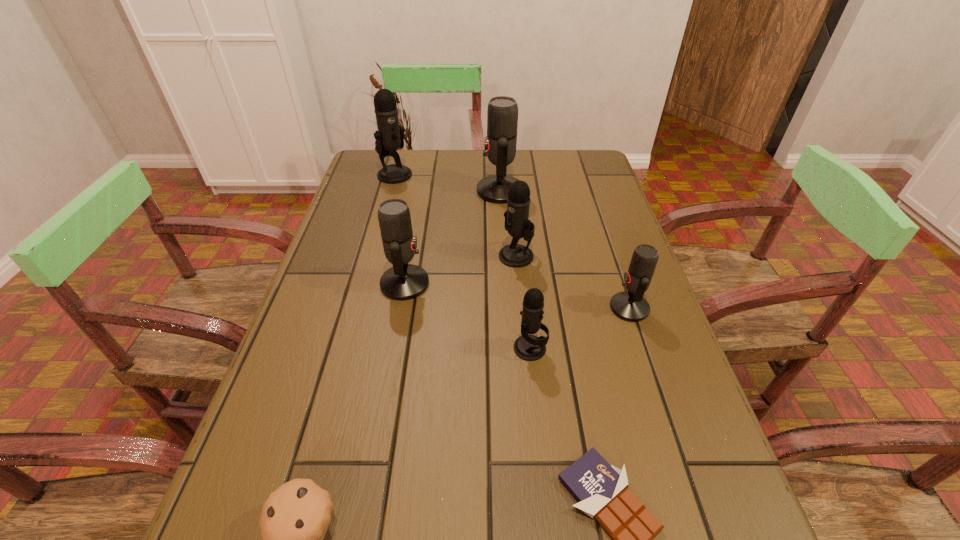
The image size is (960, 540). Find the location of `object that is at the right edge`. object that is at the right edge is located at coordinates (631, 306).

Where is `object located in the far left corner section of the desktop`? object located in the far left corner section of the desktop is located at coordinates (389, 137).

Locate an element on the screen. This screenshot has width=960, height=540. free spot at the far edge of the desktop is located at coordinates (437, 161).

In the image, there is a desktop. Where is `blank space at the left edge`? This screenshot has height=540, width=960. blank space at the left edge is located at coordinates (257, 462).

The image size is (960, 540). I want to click on free space at the right edge, so click(x=592, y=334).

In the image, there is a desktop. At what (x,y) coordinates should I click in order to perform the action: click on free space at the far left corner. Please return your answer as a coordinate pair (x, y). This screenshot has height=540, width=960. Looking at the image, I should click on (373, 163).

In order to click on free space between the rightmost microphone and the second biggest red microphone in this screenshot , I will do `click(517, 295)`.

Find the location of a particular element. The height and width of the screenshot is (540, 960). vacant region between the nearest microphone and the biggest black microphone is located at coordinates (463, 261).

What are the coordinates of `vacant area between the rightmost red microphone and the second farthest black microphone` in the screenshot? It's located at (573, 282).

You are a GUI agent. You are given a task and a screenshot of the screen. Output one action in this format:
    pyautogui.click(x=<x>, y=<y>)
    Task: Click on the free spot between the second red microphone from right to left and the rightmost red microphone
    
    Given the screenshot: What is the action you would take?
    pyautogui.click(x=564, y=249)